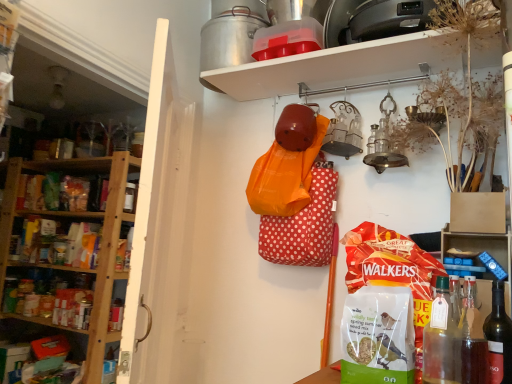
Measure the distance between point (475, 288) and camera.

The distance of point (475, 288) from camera is 4.27 feet.

Measure the distance between dark red glass bottle at lower right, the 3th bottle positioned from the left, and camera.

They are 3.39 feet apart.

What do you see at coordinates (499, 338) in the screenshot? I see `dark red glass bottle at lower right, which is the 1th bottle from right to left` at bounding box center [499, 338].

Describe the element at coordinates (69, 227) in the screenshot. The height and width of the screenshot is (384, 512). I see `white plastic shelf at upper center, which appears as the 1th shelf when viewed from the left` at that location.

The width and height of the screenshot is (512, 384). What do you see at coordinates (478, 245) in the screenshot?
I see `blue plastic blocks at right, arranged as the first shelf when viewed from the right` at bounding box center [478, 245].

Consider the image. Measure the distance between metallic silver at upper center, the second shelf in the right-to-left sequence, and camera.

They are 4.17 feet apart.

The image size is (512, 384). I want to click on transparent glass bottle at lower right, the first bottle positioned from the left, so click(x=441, y=340).

Identify the location of translucent glass bottle at lower right, which appears as the 2th bottle when viewed from the right. (472, 337).

Can you confirm if translucent glass bottle at lower right, which appears as the 2th bottle when viewed from the right, is wider than dark red glass bottle at lower right, which is the 1th bottle from right to left?

Indeed, translucent glass bottle at lower right, which appears as the 2th bottle when viewed from the right, has a greater width compared to dark red glass bottle at lower right, which is the 1th bottle from right to left.

From the image's perspective, which object appears higher, translucent glass bottle at lower right, which is the 2th bottle from left to right, or dark red glass bottle at lower right, which is the 1th bottle from right to left?

translucent glass bottle at lower right, which is the 2th bottle from left to right.

Considering the relative positions of translucent glass bottle at lower right, which is the 2th bottle from left to right, and dark red glass bottle at lower right, which is the 1th bottle from right to left, in the image provided, is translucent glass bottle at lower right, which is the 2th bottle from left to right, to the left of dark red glass bottle at lower right, which is the 1th bottle from right to left, from the viewer's perspective?

Yes, translucent glass bottle at lower right, which is the 2th bottle from left to right, is to the left of dark red glass bottle at lower right, which is the 1th bottle from right to left.

Considering the sizes of objects translucent glass bottle at lower right, which appears as the 2th bottle when viewed from the right, and dark red glass bottle at lower right, the 3th bottle positioned from the left, in the image provided, who is smaller, translucent glass bottle at lower right, which appears as the 2th bottle when viewed from the right, or dark red glass bottle at lower right, the 3th bottle positioned from the left,?

With smaller size is dark red glass bottle at lower right, the 3th bottle positioned from the left.

Between point (450, 363) and point (495, 310), which one is positioned in front?

Positioned in front is point (450, 363).

Is transparent glass bottle at lower right, which is counted as the 3th bottle, starting from the right, positioned far away from dark red glass bottle at lower right, which is the 1th bottle from right to left?

No, transparent glass bottle at lower right, which is counted as the 3th bottle, starting from the right, is not far away from dark red glass bottle at lower right, which is the 1th bottle from right to left.

From the image's perspective, would you say transparent glass bottle at lower right, which is counted as the 3th bottle, starting from the right, is positioned over dark red glass bottle at lower right, the 3th bottle positioned from the left?

Yes, from the image's perspective, transparent glass bottle at lower right, which is counted as the 3th bottle, starting from the right, is over dark red glass bottle at lower right, the 3th bottle positioned from the left.

Is translucent glass bottle at lower right, which is the 2th bottle from left to right, smaller than white plastic shelf at upper center, which appears as the 1th shelf when viewed from the left?

Yes, translucent glass bottle at lower right, which is the 2th bottle from left to right, is smaller than white plastic shelf at upper center, which appears as the 1th shelf when viewed from the left.

Does translucent glass bottle at lower right, which appears as the 2th bottle when viewed from the right, turn towards white plastic shelf at upper center, which is counted as the third shelf, starting from the right?

No, translucent glass bottle at lower right, which appears as the 2th bottle when viewed from the right, is not aimed at white plastic shelf at upper center, which is counted as the third shelf, starting from the right.

Considering the relative positions of translucent glass bottle at lower right, which is the 2th bottle from left to right, and white plastic shelf at upper center, which appears as the 1th shelf when viewed from the left, in the image provided, is translucent glass bottle at lower right, which is the 2th bottle from left to right, in front of white plastic shelf at upper center, which appears as the 1th shelf when viewed from the left,?

Yes.

You are a GUI agent. You are given a task and a screenshot of the screen. Output one action in this format:
    pyautogui.click(x=<x>, y=<y>)
    Task: Click on the 2nd shelf to the left of the translucent glass bottle at lower right, which is the 2th bottle from left to right, counting from the anchor's position
    This screenshot has width=512, height=384.
    Given the screenshot: What is the action you would take?
    pyautogui.click(x=69, y=227)

From a real-world perspective, between translucent glass bottle at lower right, which is the 2th bottle from left to right, and metallic silver at upper center, the second shelf in the right-to-left sequence, who is vertically lower?

From a 3D spatial view, translucent glass bottle at lower right, which is the 2th bottle from left to right, is below.

Can metallic silver at upper center, the second shelf in the right-to-left sequence, be found inside translucent glass bottle at lower right, which is the 2th bottle from left to right?

That's incorrect, metallic silver at upper center, the second shelf in the right-to-left sequence, is not inside translucent glass bottle at lower right, which is the 2th bottle from left to right.

Considering the relative sizes of translucent glass bottle at lower right, which appears as the 2th bottle when viewed from the right, and metallic silver at upper center, marked as the 2th shelf in a left-to-right arrangement, in the image provided, is translucent glass bottle at lower right, which appears as the 2th bottle when viewed from the right, thinner than metallic silver at upper center, marked as the 2th shelf in a left-to-right arrangement,?

Indeed, translucent glass bottle at lower right, which appears as the 2th bottle when viewed from the right, has a lesser width compared to metallic silver at upper center, marked as the 2th shelf in a left-to-right arrangement.

At what (x,y) coordinates should I click in order to perform the action: click on shelf on the right of metallic silver at upper center, the second shelf in the right-to-left sequence. Please return your answer as a coordinate pair (x, y). Image resolution: width=512 pixels, height=384 pixels. Looking at the image, I should click on (478, 245).

In terms of width, does blue plastic blocks at right, the third shelf from the left, look wider or thinner when compared to metallic silver at upper center, marked as the 2th shelf in a left-to-right arrangement?

Considering their sizes, blue plastic blocks at right, the third shelf from the left, looks slimmer than metallic silver at upper center, marked as the 2th shelf in a left-to-right arrangement.

From a real-world perspective, is blue plastic blocks at right, the third shelf from the left, over metallic silver at upper center, marked as the 2th shelf in a left-to-right arrangement?

Actually, blue plastic blocks at right, the third shelf from the left, is physically below metallic silver at upper center, marked as the 2th shelf in a left-to-right arrangement, in the real world.

From the image's perspective, which object appears higher, blue plastic blocks at right, arranged as the first shelf when viewed from the right, or metallic silver at upper center, the second shelf in the right-to-left sequence?

metallic silver at upper center, the second shelf in the right-to-left sequence.

From the image's perspective, is white plastic shelf at upper center, which is counted as the third shelf, starting from the right, beneath metallic silver at upper center, the second shelf in the right-to-left sequence?

Yes, from the image's perspective, white plastic shelf at upper center, which is counted as the third shelf, starting from the right, is beneath metallic silver at upper center, the second shelf in the right-to-left sequence.

Can you confirm if white plastic shelf at upper center, which appears as the 1th shelf when viewed from the left, is smaller than metallic silver at upper center, the second shelf in the right-to-left sequence?

No, white plastic shelf at upper center, which appears as the 1th shelf when viewed from the left, is not smaller than metallic silver at upper center, the second shelf in the right-to-left sequence.

Considering the positions of point (3, 219) and point (407, 68), is point (3, 219) closer or farther from the camera than point (407, 68)?

Point (3, 219) is farther from the camera than point (407, 68).

Would you say metallic silver at upper center, marked as the 2th shelf in a left-to-right arrangement, is part of white plastic shelf at upper center, which is counted as the third shelf, starting from the right,'s contents?

No, metallic silver at upper center, marked as the 2th shelf in a left-to-right arrangement, is located outside of white plastic shelf at upper center, which is counted as the third shelf, starting from the right.

The image size is (512, 384). I want to click on shelf on the right of translucent glass bottle at lower right, which appears as the 2th bottle when viewed from the right, so click(478, 245).

From a real-world perspective, is blue plastic blocks at right, arranged as the first shelf when viewed from the right, beneath translucent glass bottle at lower right, which appears as the 2th bottle when viewed from the right?

No, from a real-world perspective, blue plastic blocks at right, arranged as the first shelf when viewed from the right, is not below translucent glass bottle at lower right, which appears as the 2th bottle when viewed from the right.

From the image's perspective, between blue plastic blocks at right, arranged as the first shelf when viewed from the right, and translucent glass bottle at lower right, which appears as the 2th bottle when viewed from the right, who is located below?

translucent glass bottle at lower right, which appears as the 2th bottle when viewed from the right, is shown below in the image.

Is blue plastic blocks at right, the third shelf from the left, turned away from translucent glass bottle at lower right, which appears as the 2th bottle when viewed from the right?

blue plastic blocks at right, the third shelf from the left, does not have its back to translucent glass bottle at lower right, which appears as the 2th bottle when viewed from the right.

This screenshot has height=384, width=512. I want to click on bottle that appears behind the translucent glass bottle at lower right, which is the 2th bottle from left to right, so click(499, 338).

Which bottle is the 2nd one when counting from the front of the dark red glass bottle at lower right, which is the 1th bottle from right to left? Please provide its 2D coordinates.

[(441, 340)]

Which object lies further to the anchor point translucent glass bottle at lower right, which is the 2th bottle from left to right, metallic silver at upper center, marked as the 2th shelf in a left-to-right arrangement, or blue plastic blocks at right, arranged as the first shelf when viewed from the right?

Among the two, metallic silver at upper center, marked as the 2th shelf in a left-to-right arrangement, is located further to translucent glass bottle at lower right, which is the 2th bottle from left to right.

Estimate the real-world distances between objects in this image. Which object is further from transparent glass bottle at lower right, which is counted as the 3th bottle, starting from the right, blue plastic blocks at right, the third shelf from the left, or translucent glass bottle at lower right, which is the 2th bottle from left to right?

blue plastic blocks at right, the third shelf from the left, is positioned further to the anchor transparent glass bottle at lower right, which is counted as the 3th bottle, starting from the right.

Based on their spatial positions, is dark red glass bottle at lower right, the 3th bottle positioned from the left, or metallic silver at upper center, the second shelf in the right-to-left sequence, further from blue plastic blocks at right, the third shelf from the left?

metallic silver at upper center, the second shelf in the right-to-left sequence, is positioned further to the anchor blue plastic blocks at right, the third shelf from the left.

Looking at this image, looking at the image, which one is located closer to white plastic shelf at upper center, which appears as the 1th shelf when viewed from the left, translucent glass bottle at lower right, which is the 2th bottle from left to right, or dark red glass bottle at lower right, the 3th bottle positioned from the left?

translucent glass bottle at lower right, which is the 2th bottle from left to right, lies closer to white plastic shelf at upper center, which appears as the 1th shelf when viewed from the left, than the other object.

Estimate the real-world distances between objects in this image. Which object is closer to dark red glass bottle at lower right, which is the 1th bottle from right to left, blue plastic blocks at right, arranged as the first shelf when viewed from the right, or white plastic shelf at upper center, which appears as the 1th shelf when viewed from the left?

The object closer to dark red glass bottle at lower right, which is the 1th bottle from right to left, is blue plastic blocks at right, arranged as the first shelf when viewed from the right.

From the picture: Based on their spatial positions, is metallic silver at upper center, the second shelf in the right-to-left sequence, or white plastic shelf at upper center, which is counted as the third shelf, starting from the right, further from translucent glass bottle at lower right, which appears as the 2th bottle when viewed from the right?

Among the two, white plastic shelf at upper center, which is counted as the third shelf, starting from the right, is located further to translucent glass bottle at lower right, which appears as the 2th bottle when viewed from the right.

Which object lies nearer to the anchor point transparent glass bottle at lower right, the first bottle positioned from the left, translucent glass bottle at lower right, which is the 2th bottle from left to right, or metallic silver at upper center, marked as the 2th shelf in a left-to-right arrangement?

translucent glass bottle at lower right, which is the 2th bottle from left to right, lies closer to transparent glass bottle at lower right, the first bottle positioned from the left, than the other object.

Looking at this image, estimate the real-world distances between objects in this image. Which object is closer to metallic silver at upper center, marked as the 2th shelf in a left-to-right arrangement, translucent glass bottle at lower right, which is the 2th bottle from left to right, or blue plastic blocks at right, the third shelf from the left?

blue plastic blocks at right, the third shelf from the left, lies closer to metallic silver at upper center, marked as the 2th shelf in a left-to-right arrangement, than the other object.

This screenshot has height=384, width=512. What are the coordinates of `bottle between transparent glass bottle at lower right, which is counted as the 3th bottle, starting from the right, and dark red glass bottle at lower right, the 3th bottle positioned from the left, from left to right` in the screenshot? It's located at (472, 337).

Locate an element on the screen. This screenshot has width=512, height=384. shelf between white plastic shelf at upper center, which appears as the 1th shelf when viewed from the left, and transparent glass bottle at lower right, which is counted as the 3th bottle, starting from the right, in the horizontal direction is located at coordinates (338, 66).

The height and width of the screenshot is (384, 512). In order to click on shelf between white plastic shelf at upper center, which is counted as the third shelf, starting from the right, and blue plastic blocks at right, arranged as the first shelf when viewed from the right, from left to right in this screenshot , I will do tap(338, 66).

Where is `bottle situated between white plastic shelf at upper center, which is counted as the third shelf, starting from the right, and translucent glass bottle at lower right, which appears as the 2th bottle when viewed from the right, from left to right`? The image size is (512, 384). bottle situated between white plastic shelf at upper center, which is counted as the third shelf, starting from the right, and translucent glass bottle at lower right, which appears as the 2th bottle when viewed from the right, from left to right is located at coordinates (441, 340).